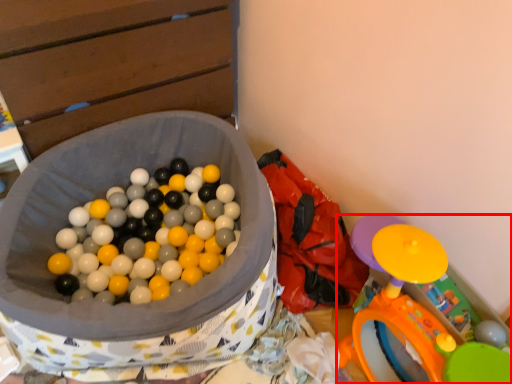
Question: Observing the image, what is the correct spatial positioning of toy (annotated by the red box) in reference to bean bag chair?

Choices:
 (A) right
 (B) left

Answer: (A)